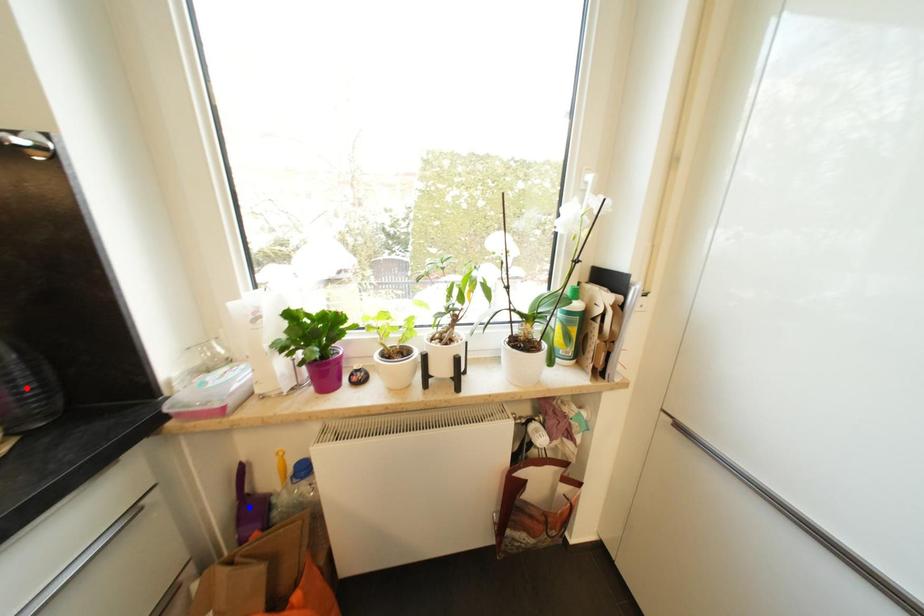
Question: Which of the two points in the image is closer to the camera?

Choices:
 (A) Blue point is closer.
 (B) Red point is closer.

Answer: (B)